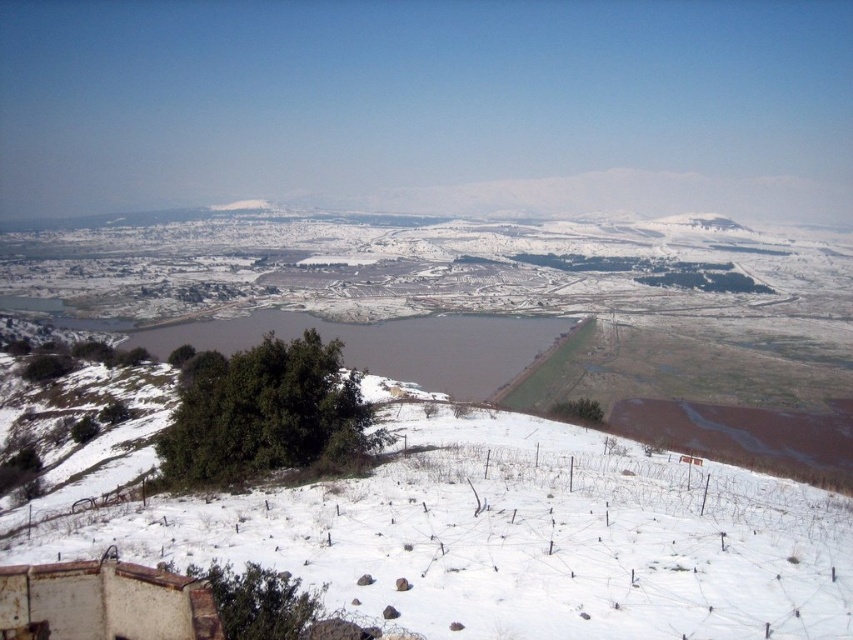
Does white powdery snow at center come in front of brown matte lake at center?

Yes, it is in front of brown matte lake at center.

Can you confirm if white powdery snow at center is positioned to the left of brown matte lake at center?

In fact, white powdery snow at center is to the right of brown matte lake at center.

Where is `white powdery snow at center`? Image resolution: width=853 pixels, height=640 pixels. white powdery snow at center is located at coordinates (515, 538).